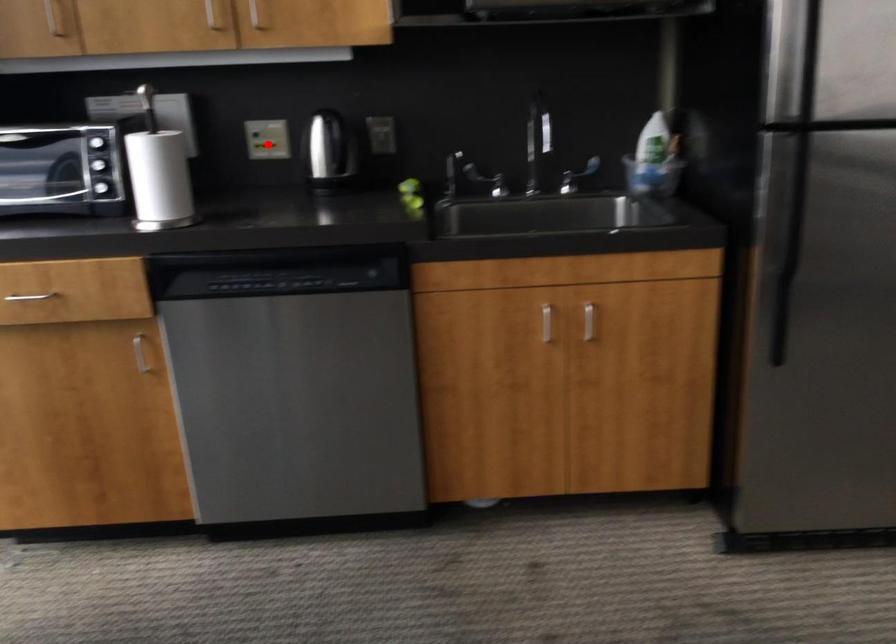
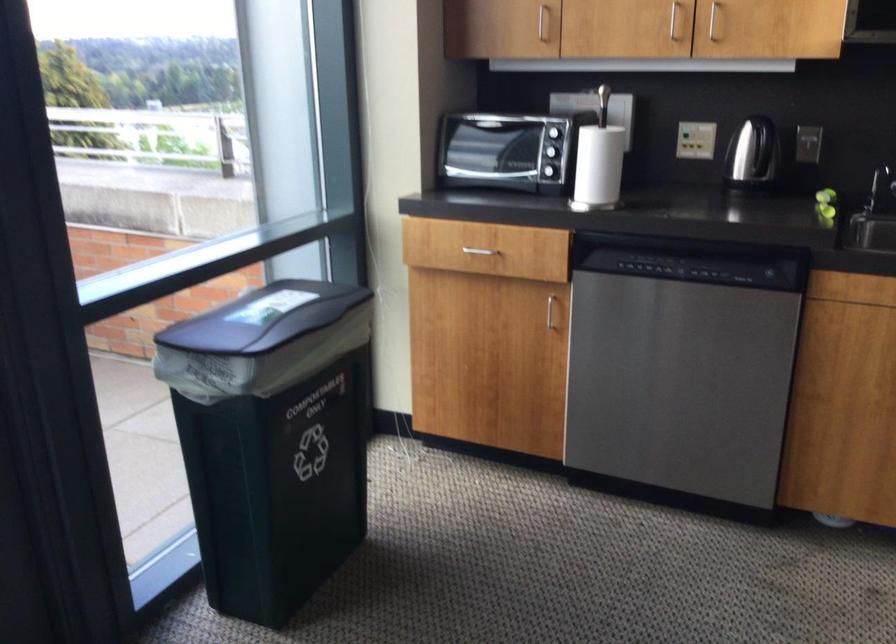
In the second image, find the point that corresponds to the highlighted location in the first image.

(695, 140)